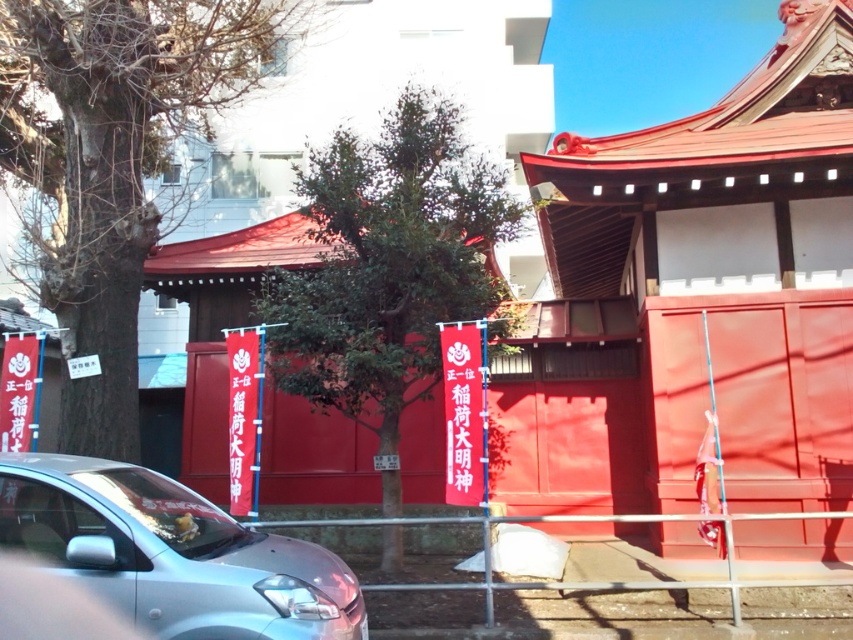
Question: Is smooth red temple at center below green leafy tree at center?

Choices:
 (A) yes
 (B) no

Answer: (B)

Question: Which point is closer to the camera?

Choices:
 (A) smooth red temple at center
 (B) silver metallic car at lower left
 (C) bare wood tree at left
 (D) green leafy tree at center

Answer: (B)

Question: Is smooth red temple at center positioned at the back of silver metallic car at lower left?

Choices:
 (A) no
 (B) yes

Answer: (B)

Question: Which of the following is the farthest from the observer?

Choices:
 (A) silver metallic car at lower left
 (B) smooth red temple at center

Answer: (B)

Question: Which point appears farthest from the camera in this image?

Choices:
 (A) (409, 310)
 (B) (676, 216)

Answer: (B)

Question: Is smooth red temple at center in front of green leafy tree at center?

Choices:
 (A) yes
 (B) no

Answer: (B)